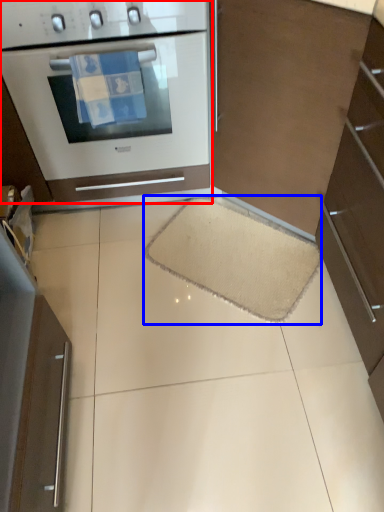
Question: Among these objects, which one is farthest to the camera, home appliance (highlighted by a red box) or doormat (highlighted by a blue box)?

Choices:
 (A) home appliance
 (B) doormat

Answer: (B)